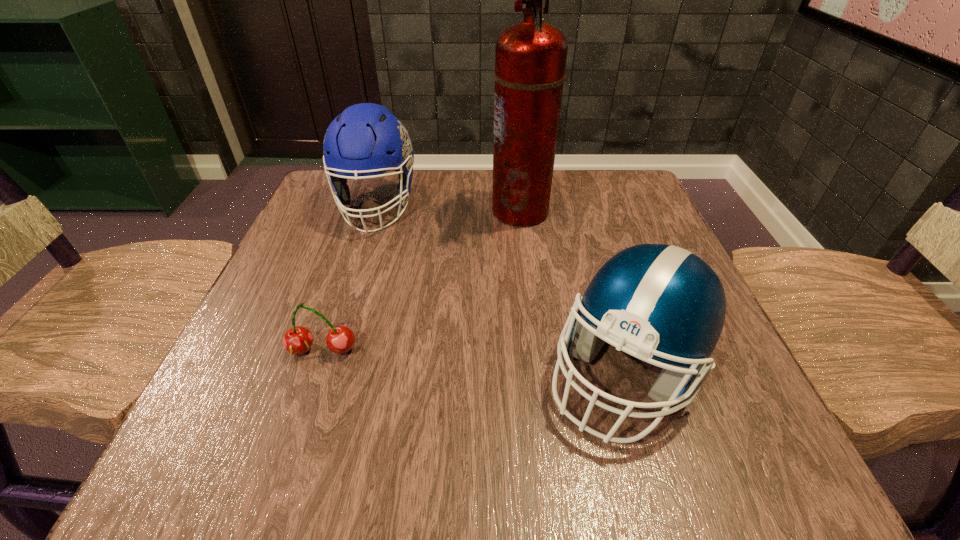
Identify the location of fire extinguisher. The width and height of the screenshot is (960, 540). (530, 57).

Image resolution: width=960 pixels, height=540 pixels. In order to click on the farther football helmet in this screenshot , I will do `click(366, 139)`.

Where is `the right football helmet`? The image size is (960, 540). the right football helmet is located at coordinates (660, 301).

This screenshot has height=540, width=960. Find the location of `cherry`. cherry is located at coordinates (297, 340).

Where is `vacant area situated 0.380m on the side of the fire extinguisher with the handle and hose`? The width and height of the screenshot is (960, 540). vacant area situated 0.380m on the side of the fire extinguisher with the handle and hose is located at coordinates (320, 211).

What are the coordinates of `free region located on the side of the fire extinguisher with the handle and hose` in the screenshot? It's located at click(388, 211).

The image size is (960, 540). I want to click on vacant space located 0.140m on the side of the fire extinguisher with the handle and hose, so click(428, 211).

Identify the location of vacant space located on the face guard of the farther football helmet. This screenshot has width=960, height=540. (320, 384).

Where is `vacant space positioned 0.070m with stems pointing upwards on the cherry`? This screenshot has height=540, width=960. vacant space positioned 0.070m with stems pointing upwards on the cherry is located at coordinates (305, 403).

The image size is (960, 540). In order to click on fire extinguisher present at the far edge in this screenshot , I will do `click(530, 57)`.